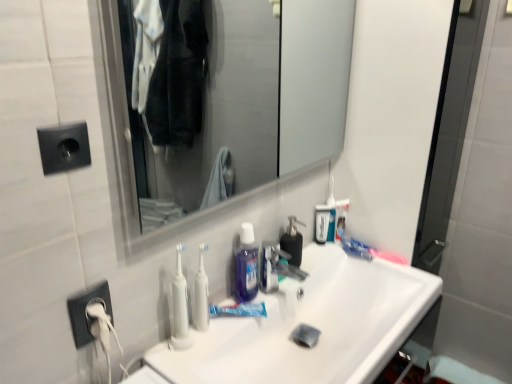
This screenshot has height=384, width=512. What are the coordinates of `vacant area that lies in front of blue glossy toothpaste at center` in the screenshot? It's located at (215, 345).